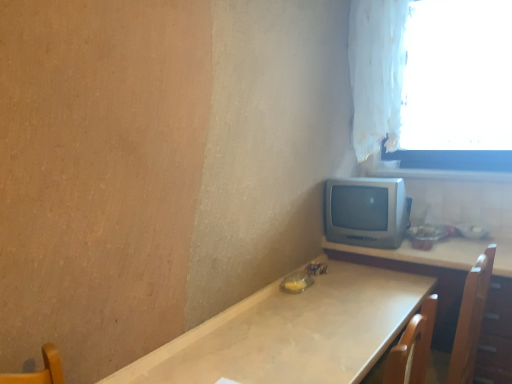
Question: Does white fabric curtain at upper right have a lesser height compared to matte wooden table at right, which is the 2th table from left to right?

Choices:
 (A) yes
 (B) no

Answer: (B)

Question: Does white fabric curtain at upper right lie behind matte wooden table at right, which is the 1th table from right to left?

Choices:
 (A) no
 (B) yes

Answer: (B)

Question: Is white fabric curtain at upper right directly adjacent to matte wooden table at right, which is the 2th table from left to right?

Choices:
 (A) no
 (B) yes

Answer: (A)

Question: Is white fabric curtain at upper right thinner than matte wooden table at right, which is the 2th table from left to right?

Choices:
 (A) no
 (B) yes

Answer: (B)

Question: Can you confirm if white fabric curtain at upper right is bigger than matte wooden table at right, which is the 1th table from right to left?

Choices:
 (A) no
 (B) yes

Answer: (A)

Question: Is point (342, 228) closer or farther from the camera than point (442, 114)?

Choices:
 (A) closer
 (B) farther

Answer: (A)

Question: From the image's perspective, is silver metallic tv at center-right located above or below white sheer curtain at upper right?

Choices:
 (A) below
 (B) above

Answer: (A)

Question: Considering the positions of silver metallic tv at center-right and white sheer curtain at upper right in the image, is silver metallic tv at center-right taller or shorter than white sheer curtain at upper right?

Choices:
 (A) short
 (B) tall

Answer: (A)

Question: In terms of width, does silver metallic tv at center-right look wider or thinner when compared to white sheer curtain at upper right?

Choices:
 (A) wide
 (B) thin

Answer: (A)

Question: Is matte white table at center, which appears as the second table when viewed from the right, taller or shorter than matte wooden table at right, which is the 2th table from left to right?

Choices:
 (A) short
 (B) tall

Answer: (A)

Question: Is matte white table at center, which appears as the second table when viewed from the right, in front of or behind matte wooden table at right, which is the 1th table from right to left, in the image?

Choices:
 (A) front
 (B) behind

Answer: (A)

Question: From the image's perspective, is matte white table at center, which appears as the second table when viewed from the right, located above or below matte wooden table at right, which is the 1th table from right to left?

Choices:
 (A) above
 (B) below

Answer: (B)

Question: From a real-world perspective, relative to matte wooden table at right, which is the 1th table from right to left, is matte white table at center, which appears as the second table when viewed from the right, vertically above or below?

Choices:
 (A) below
 (B) above

Answer: (A)

Question: Is point (480, 344) positioned closer to the camera than point (382, 74)?

Choices:
 (A) farther
 (B) closer

Answer: (B)

Question: Considering their positions, is matte wooden table at right, which is the 2th table from left to right, located in front of or behind white fabric curtain at upper right?

Choices:
 (A) front
 (B) behind

Answer: (A)